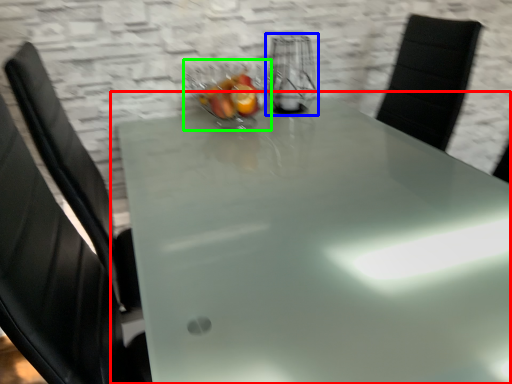
Question: Based on their relative distances, which object is farther from table (highlighted by a red box)? Choose from appliance (highlighted by a blue box) and glass bowl (highlighted by a green box).

Choices:
 (A) appliance
 (B) glass bowl

Answer: (A)